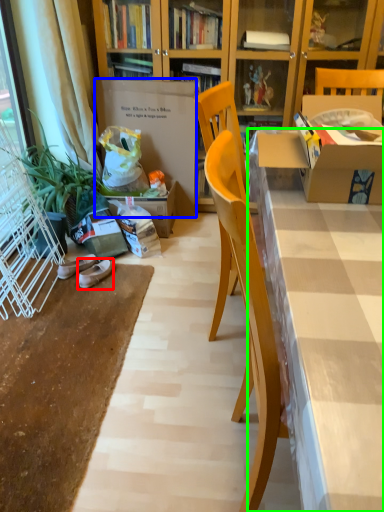
Question: Which is nearer to the footwear (highlighted by a red box)? cardboard box (highlighted by a blue box) or desk (highlighted by a green box).

Choices:
 (A) cardboard box
 (B) desk

Answer: (A)